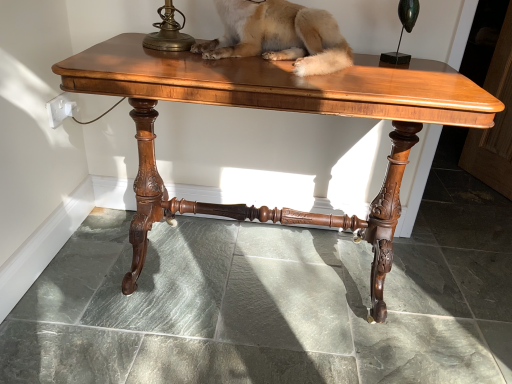
What do you see at coordinates (279, 36) in the screenshot?
I see `fuzzy beige dog at center` at bounding box center [279, 36].

What do you see at coordinates (273, 109) in the screenshot? I see `shiny brown wood table at center` at bounding box center [273, 109].

Identify the location of fuzzy beige dog at center. The height and width of the screenshot is (384, 512). (279, 36).

Is fuzzy beige dog at center a part of green polished glass candle holder at upper right?

That's incorrect, fuzzy beige dog at center is not inside green polished glass candle holder at upper right.

From a real-world perspective, which is physically above, green polished glass candle holder at upper right or fuzzy beige dog at center?

green polished glass candle holder at upper right.

From the image's perspective, which object appears higher, green polished glass candle holder at upper right or fuzzy beige dog at center?

green polished glass candle holder at upper right appears higher in the image.

Considering the relative positions of green polished glass candle holder at upper right and fuzzy beige dog at center in the image provided, is green polished glass candle holder at upper right to the left of fuzzy beige dog at center from the viewer's perspective?

Incorrect, green polished glass candle holder at upper right is not on the left side of fuzzy beige dog at center.

From the image's perspective, which one is positioned higher, green polished glass candle holder at upper right or shiny brown wood table at center?

green polished glass candle holder at upper right, from the image's perspective.

Who is smaller, green polished glass candle holder at upper right or shiny brown wood table at center?

Smaller between the two is green polished glass candle holder at upper right.

In the image, is green polished glass candle holder at upper right positioned in front of or behind shiny brown wood table at center?

green polished glass candle holder at upper right is positioned farther from the viewer than shiny brown wood table at center.

Can you tell me how much green polished glass candle holder at upper right and shiny brown wood table at center differ in facing direction?

The angular difference between green polished glass candle holder at upper right and shiny brown wood table at center is 1.59 degrees.

Would you say fuzzy beige dog at center is to the left or to the right of green polished glass candle holder at upper right in the picture?

Based on their positions, fuzzy beige dog at center is located to the left of green polished glass candle holder at upper right.

Find the location of a particular element. The image size is (512, 384). candle holder that is above the fuzzy beige dog at center (from the image's perspective) is located at coordinates (403, 31).

Between fuzzy beige dog at center and green polished glass candle holder at upper right, which one has more height?

green polished glass candle holder at upper right.

Considering the relative sizes of fuzzy beige dog at center and green polished glass candle holder at upper right in the image provided, is fuzzy beige dog at center thinner than green polished glass candle holder at upper right?

In fact, fuzzy beige dog at center might be wider than green polished glass candle holder at upper right.

Between point (266, 0) and point (136, 213), which one is positioned behind?

The point (136, 213) is farther from the camera.

Identify the location of table that appears below the fuzzy beige dog at center (from the image's perspective). Image resolution: width=512 pixels, height=384 pixels. (273, 109).

How distant is fuzzy beige dog at center from shiny brown wood table at center?

fuzzy beige dog at center is 8.20 inches from shiny brown wood table at center.

From a real-world perspective, which is physically above, fuzzy beige dog at center or shiny brown wood table at center?

fuzzy beige dog at center, from a real-world perspective.

Does shiny brown wood table at center turn towards fuzzy beige dog at center?

No, shiny brown wood table at center is not aimed at fuzzy beige dog at center.

What are the coordinates of `dog lying on the right of shiny brown wood table at center` in the screenshot? It's located at (279, 36).

Does shiny brown wood table at center have a lesser height compared to fuzzy beige dog at center?

In fact, shiny brown wood table at center may be taller than fuzzy beige dog at center.

Does shiny brown wood table at center have a lesser width compared to fuzzy beige dog at center?

No, shiny brown wood table at center is not thinner than fuzzy beige dog at center.

From a real-world perspective, between shiny brown wood table at center and green polished glass candle holder at upper right, who is vertically lower?

shiny brown wood table at center, from a real-world perspective.

Is point (156, 66) less distant than point (416, 1)?

That is True.

Can you confirm if shiny brown wood table at center is thinner than green polished glass candle holder at upper right?

Incorrect, the width of shiny brown wood table at center is not less than that of green polished glass candle holder at upper right.

You are a GUI agent. You are given a task and a screenshot of the screen. Output one action in this format:
    pyautogui.click(x=<x>, y=<y>)
    Task: Click on the candle holder that appears above the fuzzy beige dog at center (from a real-world perspective)
    The image size is (512, 384).
    Given the screenshot: What is the action you would take?
    pyautogui.click(x=403, y=31)

In the image, there is a green polished glass candle holder at upper right. At what (x,y) coordinates should I click in order to perform the action: click on table below it (from the image's perspective). Please return your answer as a coordinate pair (x, y). This screenshot has width=512, height=384. Looking at the image, I should click on (273, 109).

From the image, which object appears to be nearer to shiny brown wood table at center, green polished glass candle holder at upper right or fuzzy beige dog at center?

Based on the image, fuzzy beige dog at center appears to be nearer to shiny brown wood table at center.

Estimate the real-world distances between objects in this image. Which object is further from green polished glass candle holder at upper right, fuzzy beige dog at center or shiny brown wood table at center?

Among the two, shiny brown wood table at center is located further to green polished glass candle holder at upper right.

From the image, which object appears to be nearer to shiny brown wood table at center, fuzzy beige dog at center or green polished glass candle holder at upper right?

fuzzy beige dog at center is closer to shiny brown wood table at center.

From the image, which object appears to be farther from fuzzy beige dog at center, shiny brown wood table at center or green polished glass candle holder at upper right?

green polished glass candle holder at upper right.

From the image, which object appears to be nearer to green polished glass candle holder at upper right, shiny brown wood table at center or fuzzy beige dog at center?

Based on the image, fuzzy beige dog at center appears to be nearer to green polished glass candle holder at upper right.

From the image, which object appears to be nearer to fuzzy beige dog at center, green polished glass candle holder at upper right or shiny brown wood table at center?

Among the two, shiny brown wood table at center is located nearer to fuzzy beige dog at center.

Where is `dog between green polished glass candle holder at upper right and shiny brown wood table at center in the vertical direction`? dog between green polished glass candle holder at upper right and shiny brown wood table at center in the vertical direction is located at coordinates (279, 36).